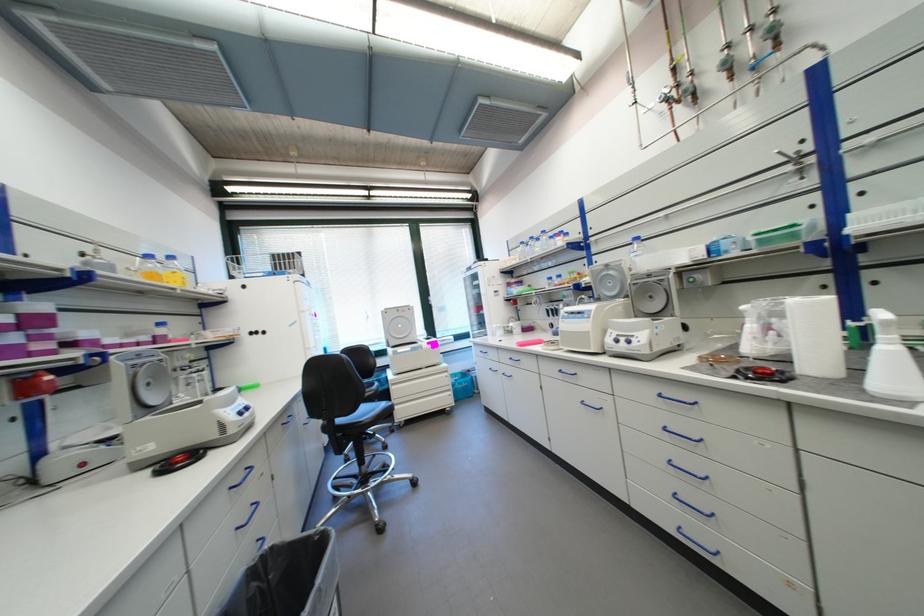
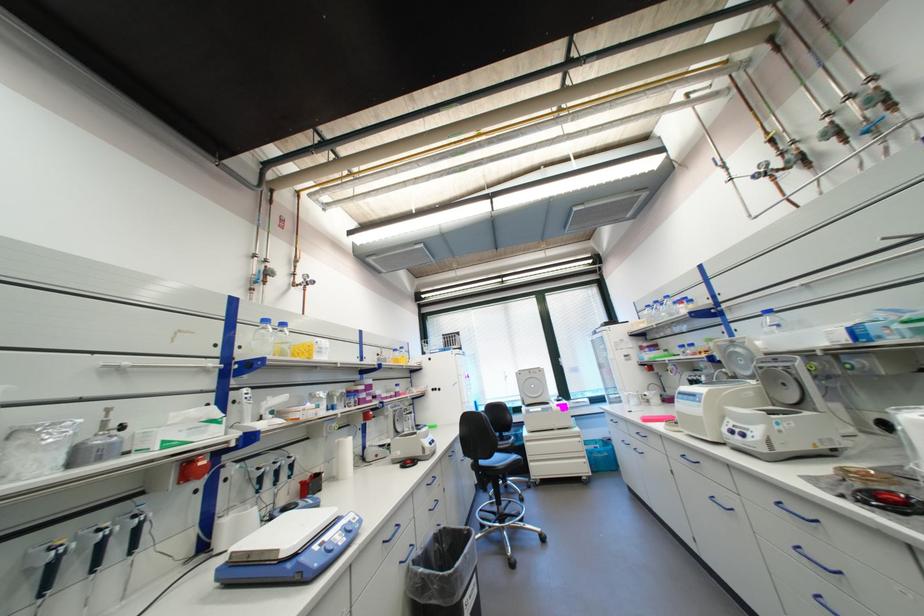
Locate, in the second image, the point that corresponds to point (672, 397) in the first image.

(795, 507)